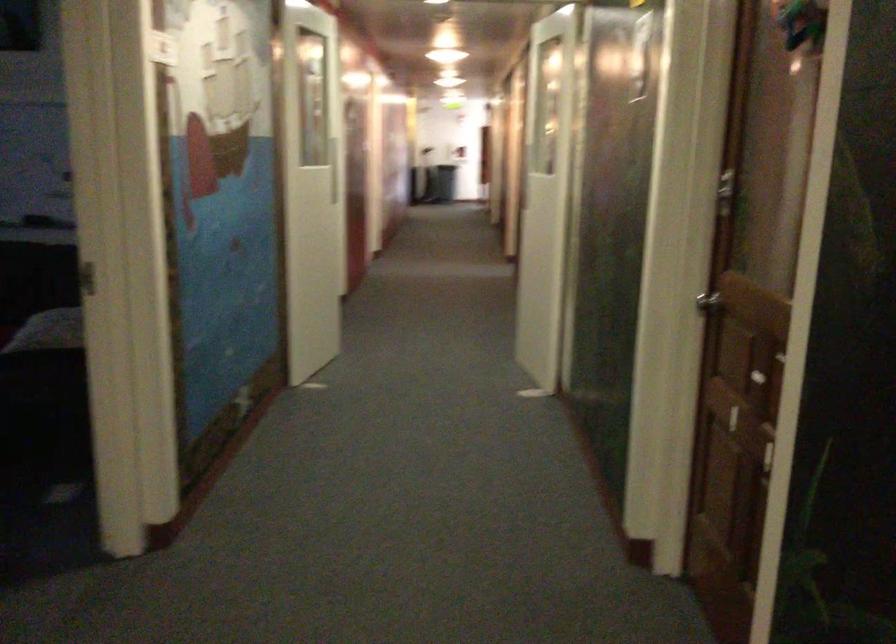
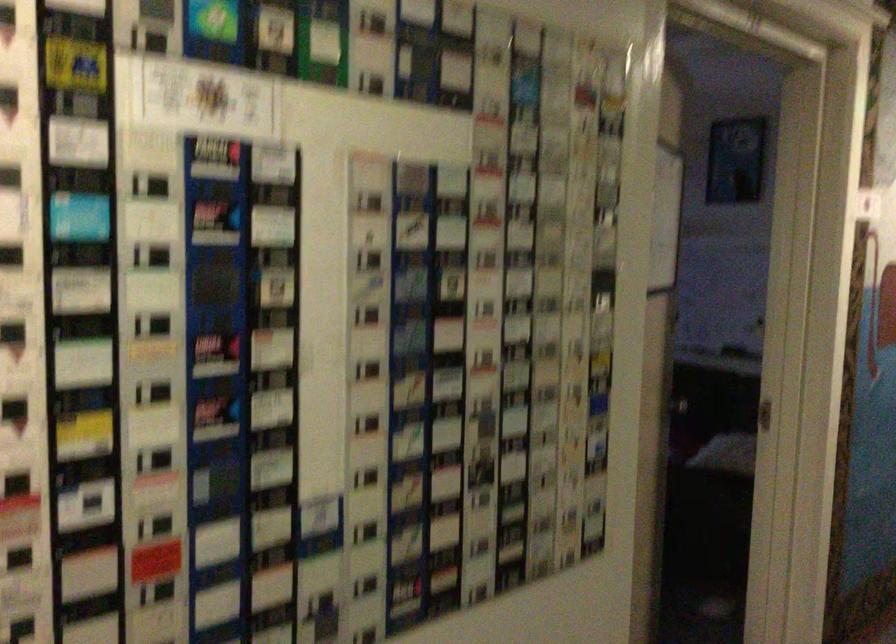
Question: The camera is either moving clockwise (left) or counter-clockwise (right) around the object. The first image is from the beginning of the video and the second image is from the end. Is the camera moving left or right when shooting the video?

Choices:
 (A) Left
 (B) Right

Answer: (B)